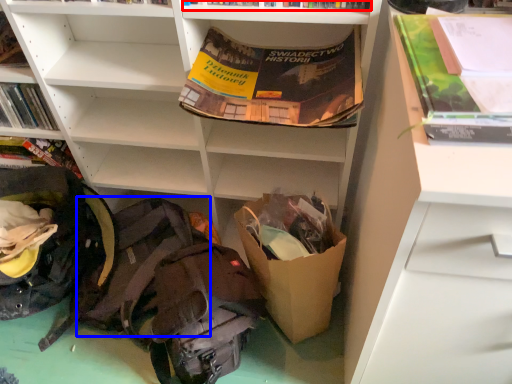
Question: Which object is closer to the camera taking this photo, book (highlighted by a red box) or backpack (highlighted by a blue box)?

Choices:
 (A) book
 (B) backpack

Answer: (A)